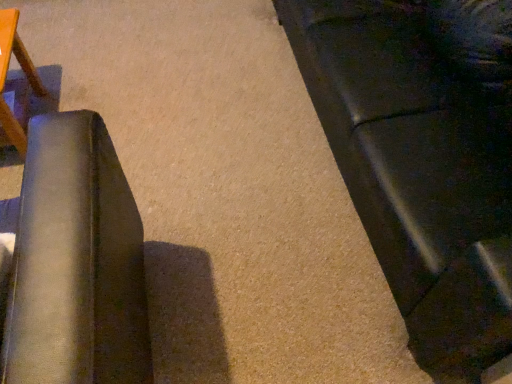
This screenshot has width=512, height=384. In order to click on matte black couch at right in this screenshot , I will do `click(423, 158)`.

What do you see at coordinates (423, 158) in the screenshot? I see `matte black couch at right` at bounding box center [423, 158].

I want to click on matte black couch at right, so click(423, 158).